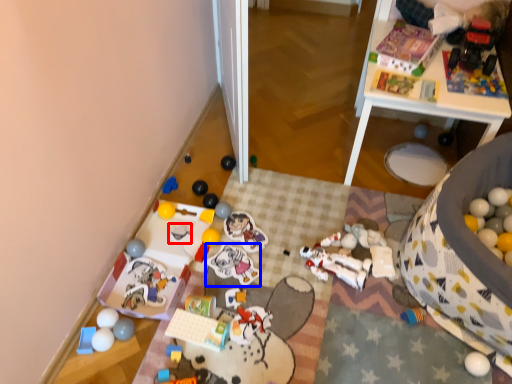
Question: Which point is further to the camera, toy (highlighted by a red box) or toy (highlighted by a blue box)?

Choices:
 (A) toy
 (B) toy

Answer: (A)